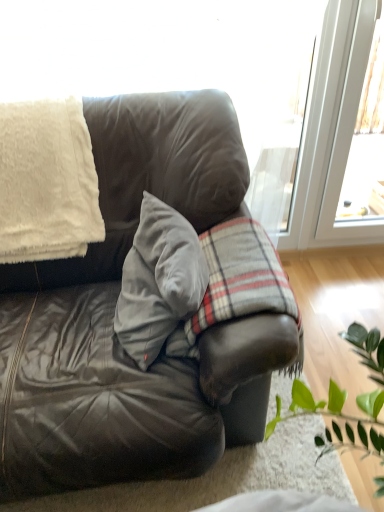
Question: Is velvet gray pillow at center located within plaid fabric at center?

Choices:
 (A) no
 (B) yes

Answer: (B)

Question: Is plaid fabric at center placed right next to velvet gray pillow at center?

Choices:
 (A) no
 (B) yes

Answer: (A)

Question: Considering the relative sizes of plaid fabric at center and velvet gray pillow at center in the image provided, is plaid fabric at center shorter than velvet gray pillow at center?

Choices:
 (A) yes
 (B) no

Answer: (B)

Question: Is plaid fabric at center at the left side of velvet gray pillow at center?

Choices:
 (A) yes
 (B) no

Answer: (B)

Question: Is plaid fabric at center thinner than velvet gray pillow at center?

Choices:
 (A) no
 (B) yes

Answer: (A)

Question: From their relative heights in the image, would you say plaid fabric at center is taller or shorter than velvet gray pillow at center?

Choices:
 (A) tall
 (B) short

Answer: (A)

Question: In terms of width, does plaid fabric at center look wider or thinner when compared to velvet gray pillow at center?

Choices:
 (A) thin
 (B) wide

Answer: (B)

Question: From a real-world perspective, is plaid fabric at center above or below velvet gray pillow at center?

Choices:
 (A) below
 (B) above

Answer: (A)

Question: Which is correct: plaid fabric at center is inside velvet gray pillow at center, or outside of it?

Choices:
 (A) inside
 (B) outside

Answer: (B)

Question: Relative to velvet gray pillow at center, is leather couch at center in front or behind?

Choices:
 (A) front
 (B) behind

Answer: (A)

Question: Which is correct: leather couch at center is inside velvet gray pillow at center, or outside of it?

Choices:
 (A) outside
 (B) inside

Answer: (A)

Question: Considering the positions of point (168, 438) and point (145, 207), is point (168, 438) closer or farther from the camera than point (145, 207)?

Choices:
 (A) farther
 (B) closer

Answer: (B)

Question: From the image's perspective, is leather couch at center positioned above or below velvet gray pillow at center?

Choices:
 (A) below
 (B) above

Answer: (A)

Question: Would you say plaid fabric at center is inside or outside leather couch at center?

Choices:
 (A) inside
 (B) outside

Answer: (A)

Question: In terms of height, does plaid fabric at center look taller or shorter compared to leather couch at center?

Choices:
 (A) short
 (B) tall

Answer: (A)